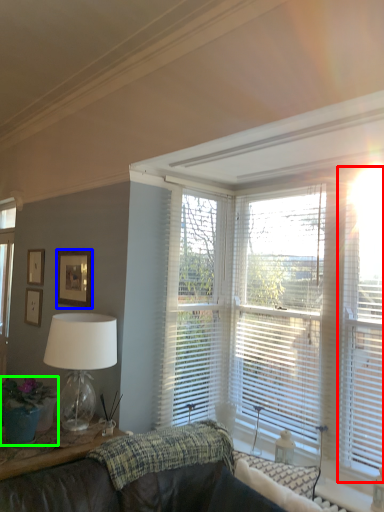
Question: Considering the real-world distances, which object is farthest from blind (highlighted by a red box)? picture frame (highlighted by a blue box) or houseplant (highlighted by a green box)?

Choices:
 (A) picture frame
 (B) houseplant

Answer: (B)